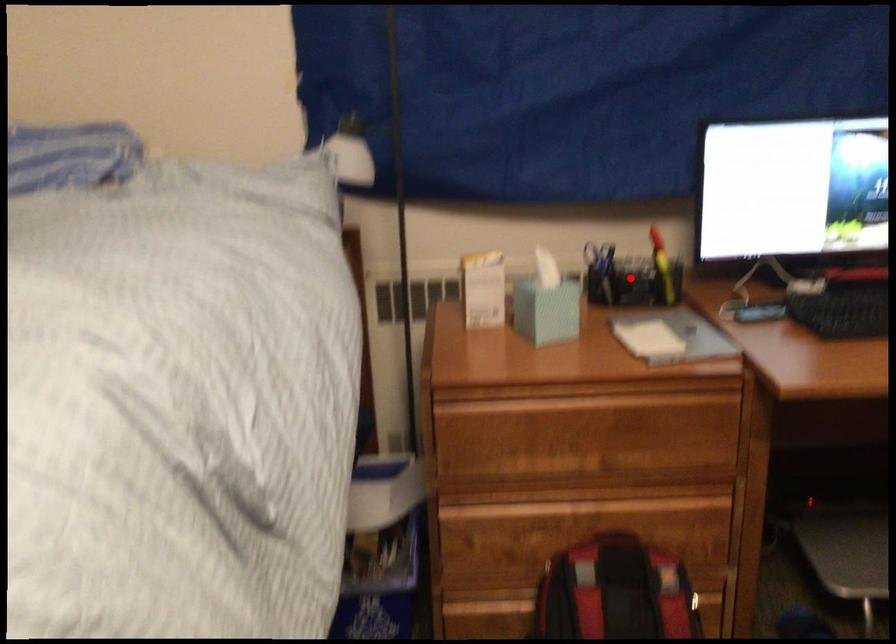
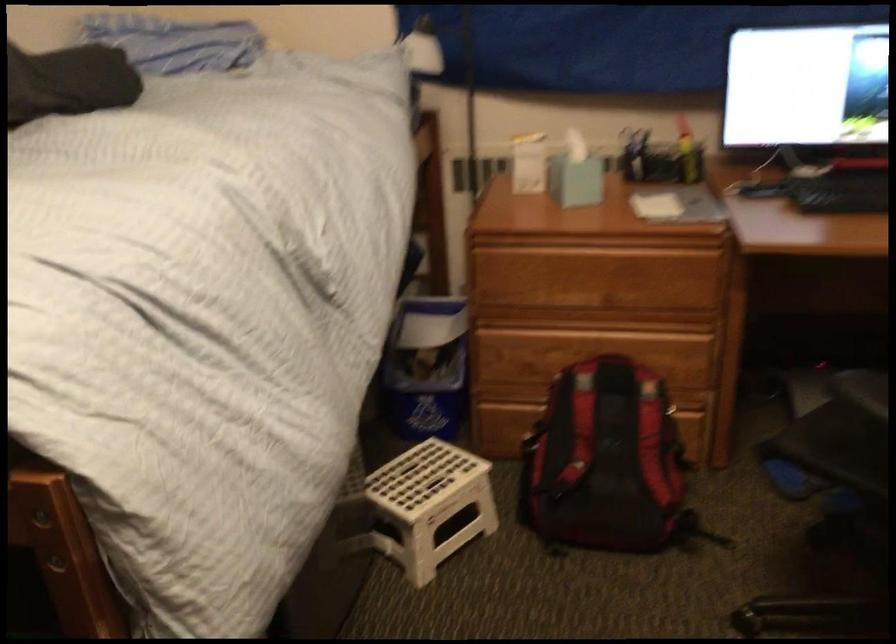
Find the pixel in the second image that matches the highlighted location in the first image.

(660, 158)